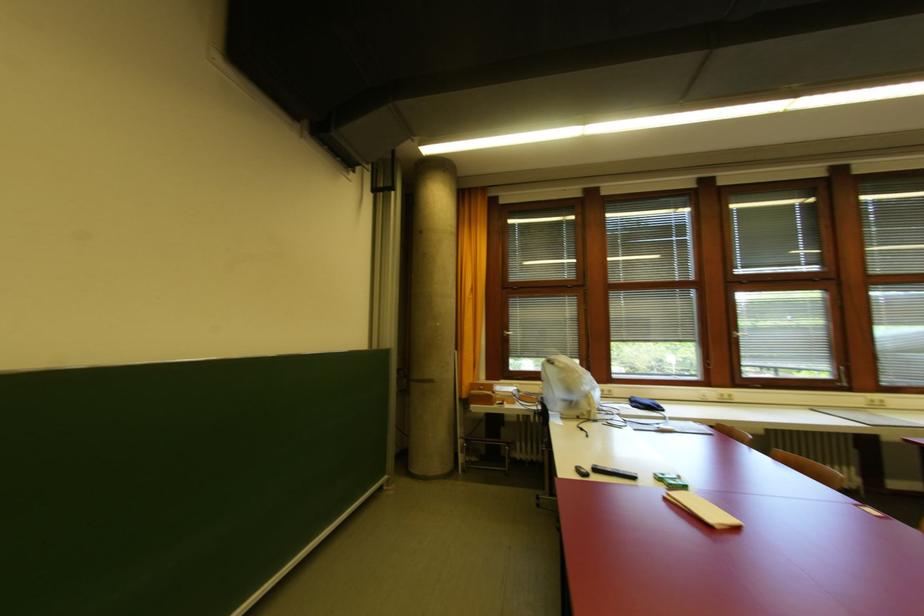
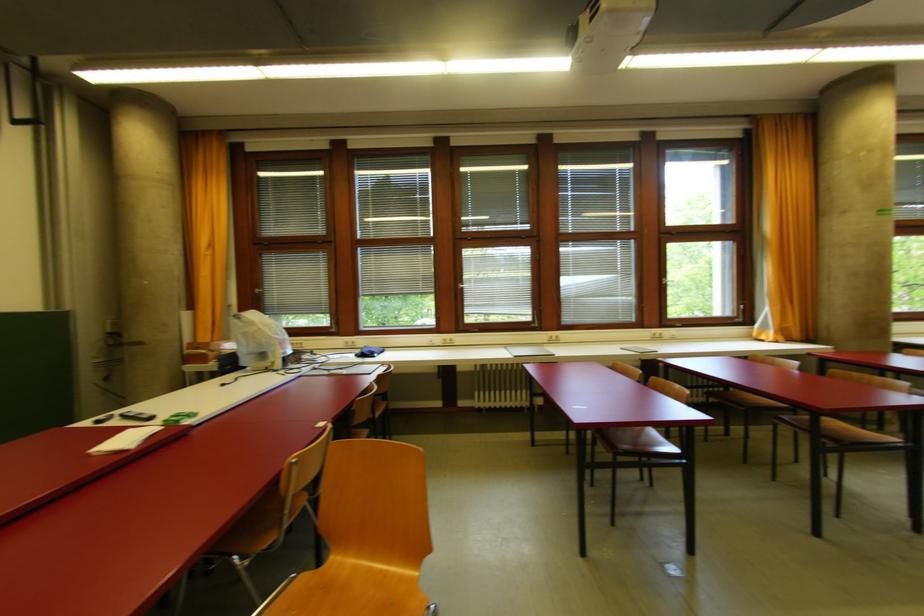
Find the pixel in the second image that matches point 733,398 in the first image.

(454, 342)